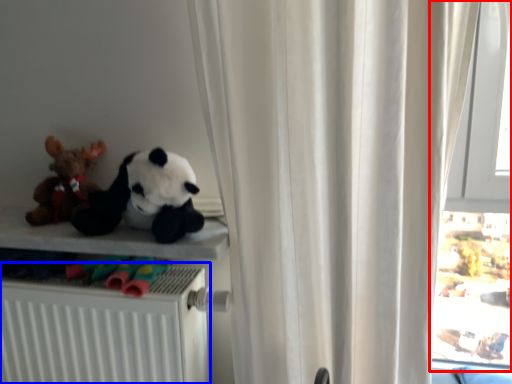
Question: Which of the following is the farthest to the observer, window (highlighted by a red box) or radiator (highlighted by a blue box)?

Choices:
 (A) window
 (B) radiator

Answer: (A)